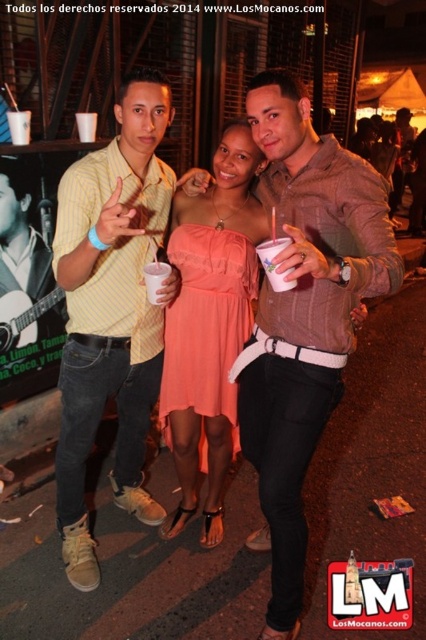
You are standing at the point with coordinates point [278,248] and want to walk to the point with coordinates point [244,291]. Which direction should you move in to reach your destination?

To reach point [244,291] from point [278,248], you should move forward since point [244,291] is behind point [278,248].

You are standing at the camera position and want to hand a yellow striped shirt at center to someone. Can you reach it without moving?

The yellow striped shirt at center is 4.90 feet away from the camera, so you cannot reach it without moving closer.

You are a photographer trying to capture a clear shot of both the matte coral dress at center and the white plastic cup at center. However, the cup is partially blocking the view of the dress. Can you adjust your position to see both objects without any obstruction?

The white plastic cup at center is behind the matte coral dress at center, so adjusting your position slightly forward or to the side might allow you to see both objects without obstruction.